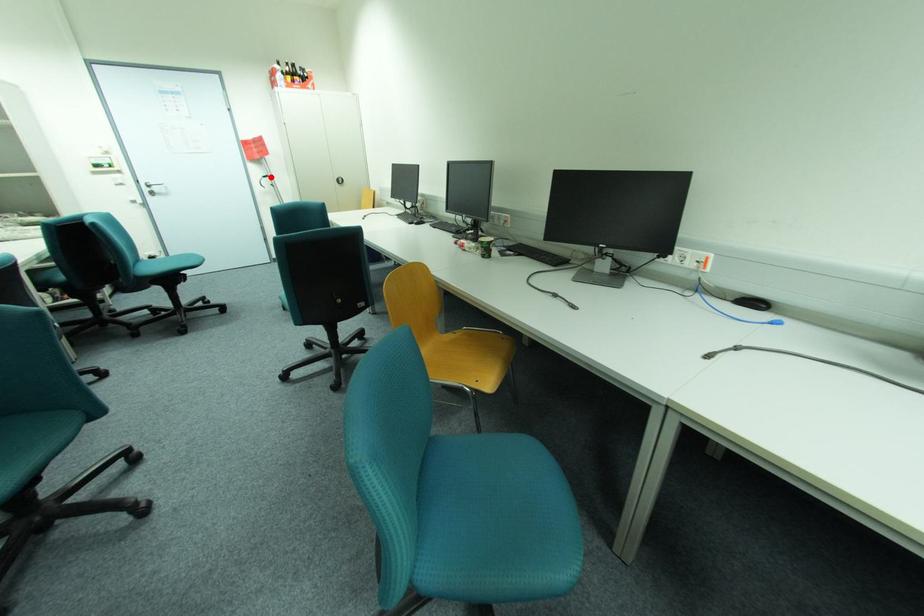
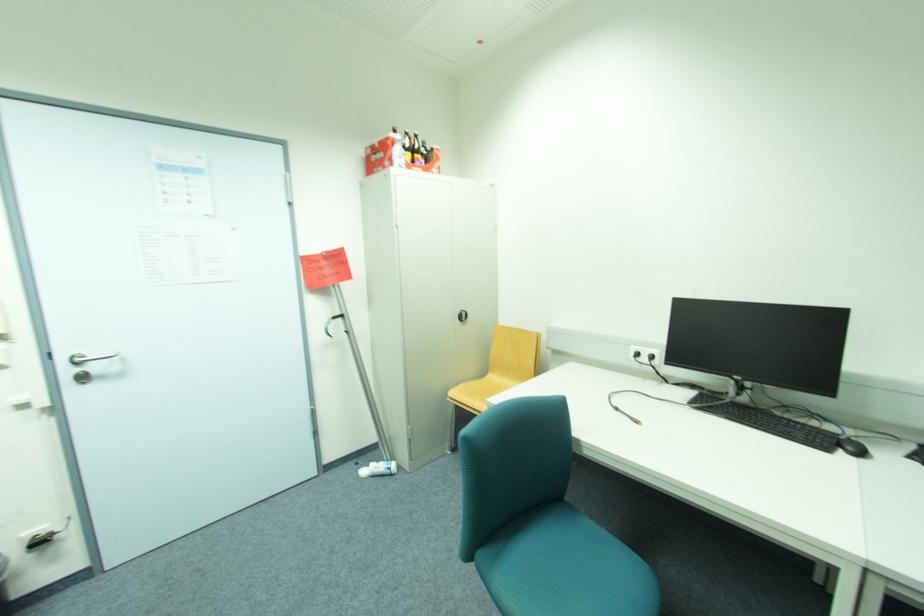
Find the pixel in the second image that matches the highlighted location in the first image.

(339, 317)